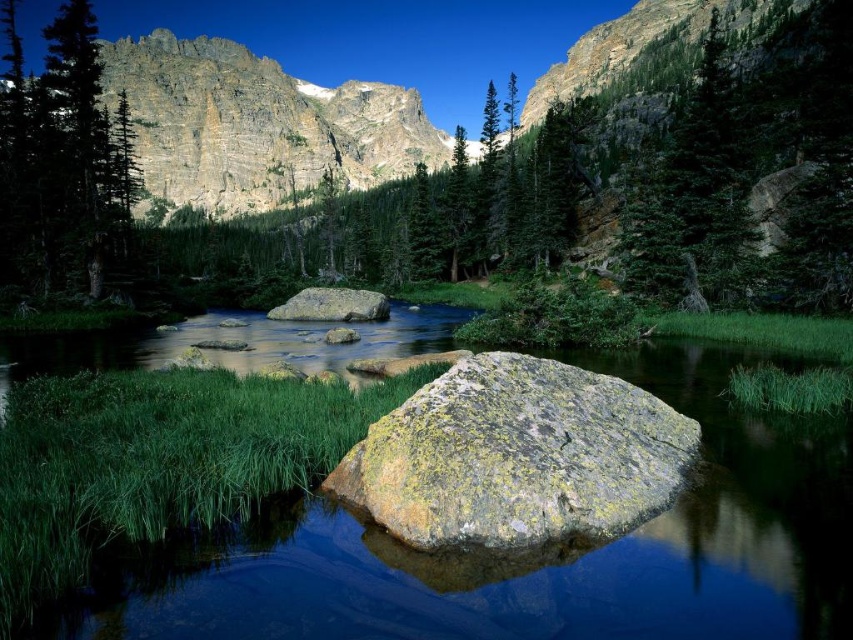
What do you see at coordinates (517, 456) in the screenshot?
I see `yellow-green mossy rock at center` at bounding box center [517, 456].

Can you confirm if yellow-green mossy rock at center is smaller than green matte tree at left?

Indeed, yellow-green mossy rock at center has a smaller size compared to green matte tree at left.

Find the location of a particular element. The height and width of the screenshot is (640, 853). yellow-green mossy rock at center is located at coordinates (517, 456).

Find the location of a particular element. The width and height of the screenshot is (853, 640). yellow-green mossy rock at center is located at coordinates (517, 456).

Is point (187, 67) behind point (53, 32)?

Yes, point (187, 67) is behind point (53, 32).

Which is above, rugged stone mountain at upper center or green matte tree at left?

Positioned higher is rugged stone mountain at upper center.

Is point (286, 104) positioned behind point (7, 282)?

Yes, it is behind point (7, 282).

Locate an element on the screen. This screenshot has height=640, width=853. rugged stone mountain at upper center is located at coordinates (257, 125).

Between rugged stone mountain at upper center and gray rough rock at center, which one is positioned lower?

gray rough rock at center

Between rugged stone mountain at upper center and gray rough rock at center, which one appears on the left side from the viewer's perspective?

rugged stone mountain at upper center is more to the left.

Is point (165, 125) positioned in front of point (341, 314)?

That is False.

Identify the location of rugged stone mountain at upper center. (257, 125).